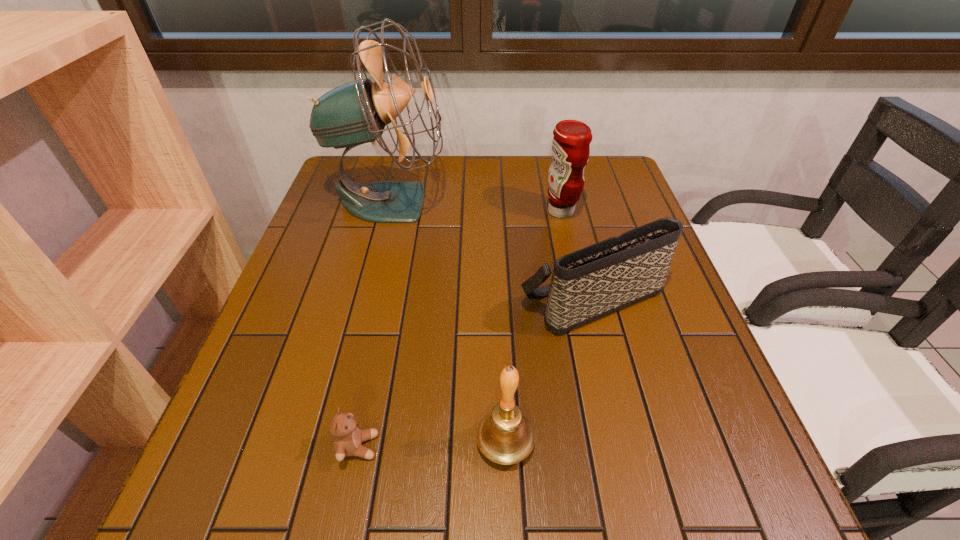
Where is `vacant space located 0.300m on the front-facing side of the teddy bear`? This screenshot has width=960, height=540. vacant space located 0.300m on the front-facing side of the teddy bear is located at coordinates (555, 446).

You are a GUI agent. You are given a task and a screenshot of the screen. Output one action in this format:
    pyautogui.click(x=<x>, y=<y>)
    Task: Click on the object at the far edge
    This screenshot has width=960, height=540.
    Given the screenshot: What is the action you would take?
    pyautogui.click(x=355, y=113)

Where is `object positioned at the left edge`? object positioned at the left edge is located at coordinates (355, 113).

Find the location of a particular element. The image size is (960, 540). object that is positioned at the right edge is located at coordinates (592, 282).

Locate an element on the screen. The width and height of the screenshot is (960, 540). object located at the far left corner is located at coordinates (355, 113).

Image resolution: width=960 pixels, height=540 pixels. I want to click on blank space at the far edge of the desktop, so click(x=476, y=161).

This screenshot has width=960, height=540. What are the coordinates of `free spot at the left edge of the desktop` in the screenshot? It's located at (320, 244).

Identify the location of vacant area at the right edge. This screenshot has width=960, height=540. (656, 299).

Identify the location of blank space at the far left corner of the desktop. (359, 172).

The width and height of the screenshot is (960, 540). Identify the location of vacant space at the near left corner of the desktop. (266, 497).